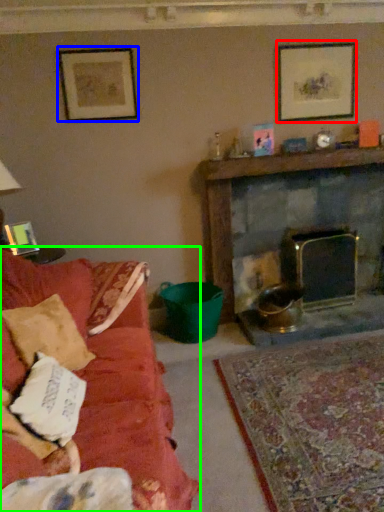
Question: Which is nearer to the picture frame (highlighted by a red box)? picture frame (highlighted by a blue box) or studio couch (highlighted by a green box).

Choices:
 (A) picture frame
 (B) studio couch

Answer: (A)